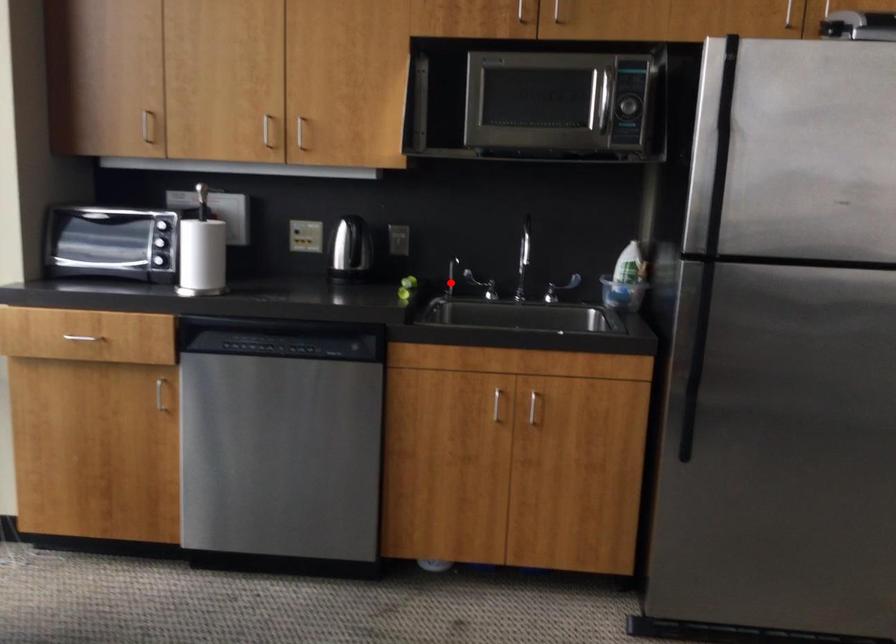
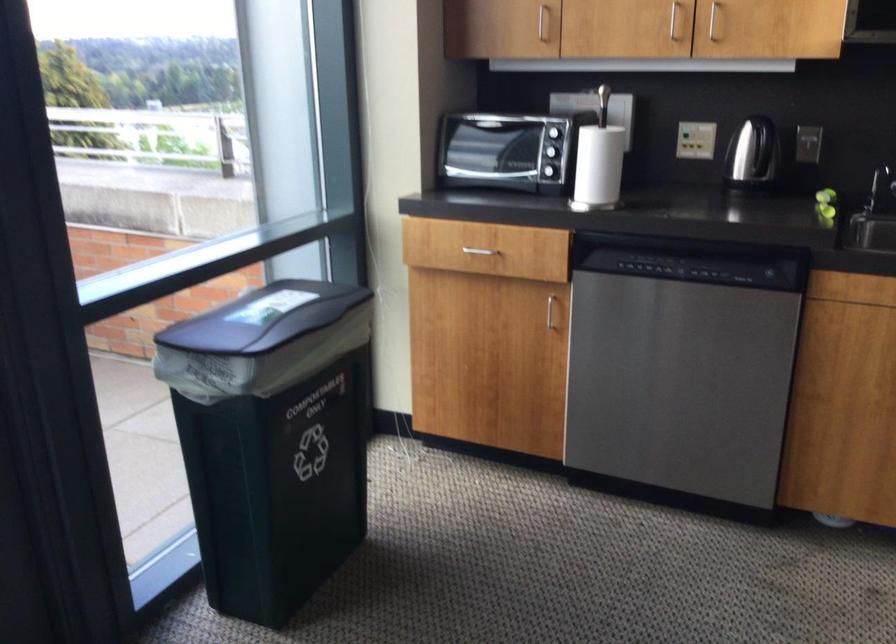
Question: A red point is marked in image1. In image2, is the corresponding 3D point closer to the camera or farther? Reply with the corresponding letter.

Choices:
 (A) The corresponding 3D point is closer.
 (B) The corresponding 3D point is farther.

Answer: (A)